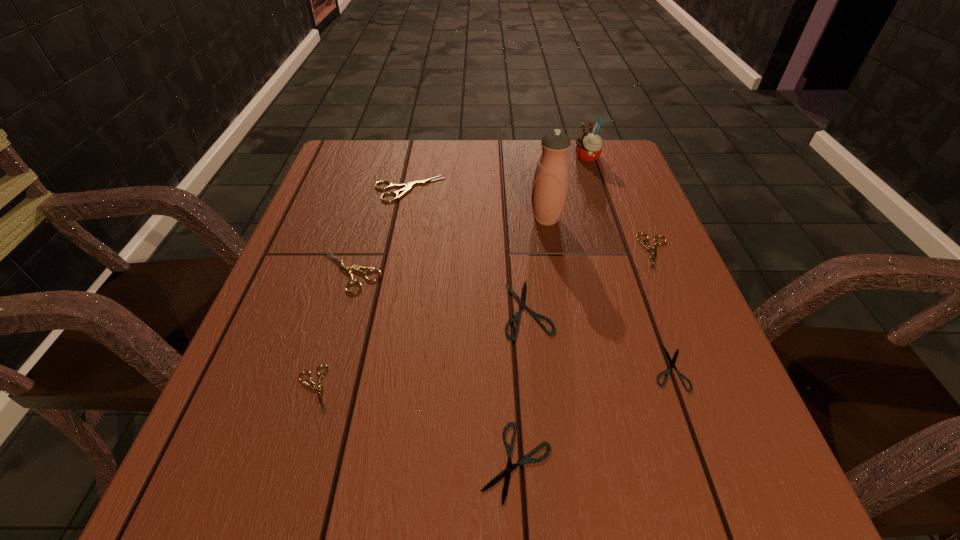
What are the coordinates of `object that stands as the fourth closest to the farthest black shears` in the screenshot? It's located at (653, 250).

Locate which object ranks second in proximity to the shortest object. Please provide its 2D coordinates. Your answer should be formatted as a tuple, i.e. [(x, y)], where the tuple contains the x and y coordinates of a point satisfying the conditions above.

[(653, 250)]

Identify which shears is located as the nearest to the farthest black shears. Please provide its 2D coordinates. Your answer should be formatted as a tuple, i.e. [(x, y)], where the tuple contains the x and y coordinates of a point satisfying the conditions above.

[(672, 365)]

Identify which shears is the second closest to the second shears from right to left. Please provide its 2D coordinates. Your answer should be formatted as a tuple, i.e. [(x, y)], where the tuple contains the x and y coordinates of a point satisfying the conditions above.

[(653, 250)]

Select which beige shears appears as the closest to the biggest black shears. Please provide its 2D coordinates. Your answer should be formatted as a tuple, i.e. [(x, y)], where the tuple contains the x and y coordinates of a point satisfying the conditions above.

[(653, 250)]

In order to click on beige shears that is the second closest to the tallest shears in this screenshot , I will do `click(653, 250)`.

Identify which black shears is the second closest to the farthest black shears. Please provide its 2D coordinates. Your answer should be formatted as a tuple, i.e. [(x, y)], where the tuple contains the x and y coordinates of a point satisfying the conditions above.

[(507, 472)]

Select which black shears appears as the third closest to the third smallest beige shears. Please provide its 2D coordinates. Your answer should be formatted as a tuple, i.e. [(x, y)], where the tuple contains the x and y coordinates of a point satisfying the conditions above.

[(672, 365)]

Locate an element on the screen. The height and width of the screenshot is (540, 960). vacant space that satisfies the following two spatial constraints: 1. on the front-facing side of the rightmost object; 2. on the left side of the farthest object is located at coordinates (619, 252).

Find the location of a particular element. free space that satisfies the following two spatial constraints: 1. on the front-facing side of the farthest object; 2. on the front side of the smallest beige shears is located at coordinates (665, 389).